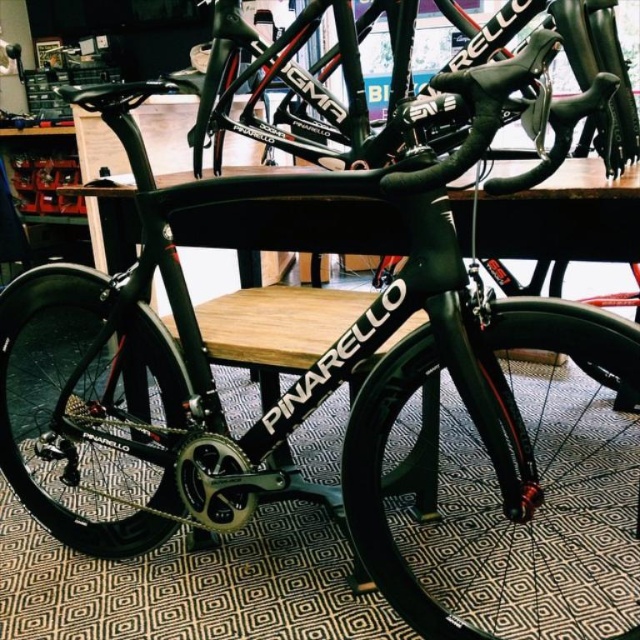
You are a bike mechanic who needs to replace the matte black wheel at center. The replacement wheel you have is 1.2 meters in diameter. Will the new wheel fit in the space between the existing wheel and the nearest object?

The existing matte black wheel at center and the nearest object are 1.18 meters apart. Since the new wheel is 1.2 meters in diameter, it will not fit in the space between them because it is slightly larger than the available gap.

You are a bike mechanic who needs to inspect the wheel at point (88, 410). The shop has a special tool that can only reach up to 0.6 meters from the center. Can you use this tool to inspect the wheel at that point?

The wheel at point (88, 410) is located at the center, so the tool can reach it since it is within the 0.6 meters range from the center.